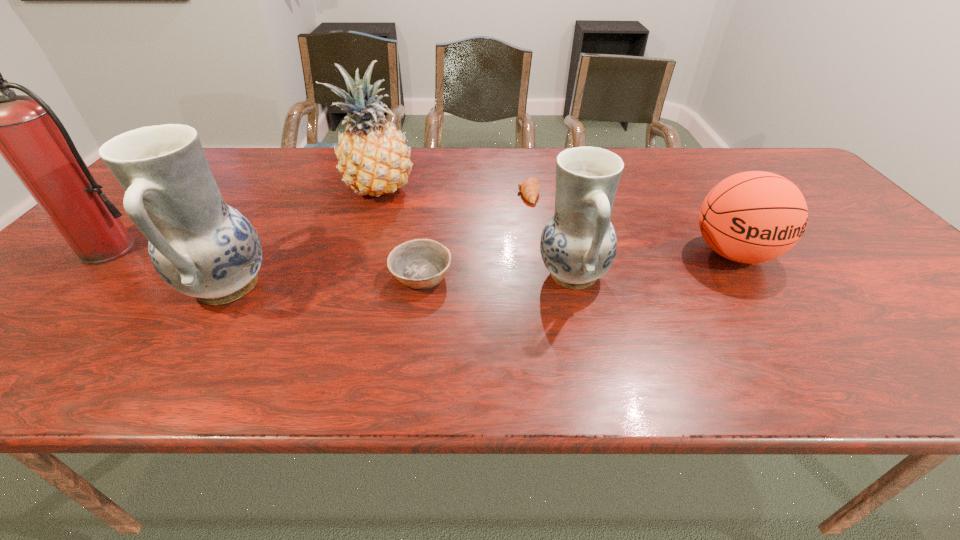
Identify the location of vacant space that is in between the left pottery and the fifth tallest object. Image resolution: width=960 pixels, height=540 pixels. (480, 270).

Identify the location of free space between the sixth tallest object and the second object from left to right. (324, 280).

Locate an element on the screen. This screenshot has width=960, height=540. the third closest object to the fourth tallest object is located at coordinates (752, 217).

I want to click on the third closest object to the bowl, so click(200, 246).

At what (x,y) coordinates should I click in order to perform the action: click on free spot that satisfies the following two spatial constraints: 1. at the nozzle of the tallest object; 2. on the right side of the right pottery. Please return your answer as a coordinate pair (x, y). The height and width of the screenshot is (540, 960). Looking at the image, I should click on (84, 275).

Find the location of a particular element. The image size is (960, 540). vacant region that satisfies the following two spatial constraints: 1. on the back side of the second shortest object; 2. on the right side of the shortest object is located at coordinates (433, 193).